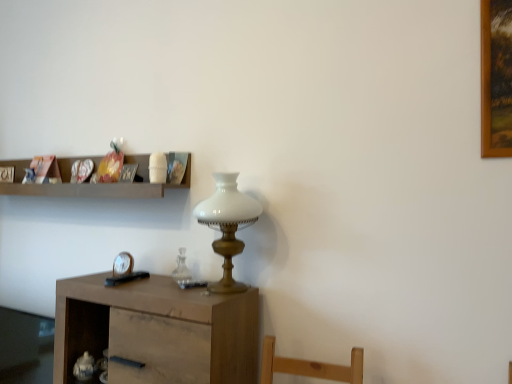
The image size is (512, 384). I want to click on vacant area that is in front of metallic silver clock at lower left, so click(x=99, y=285).